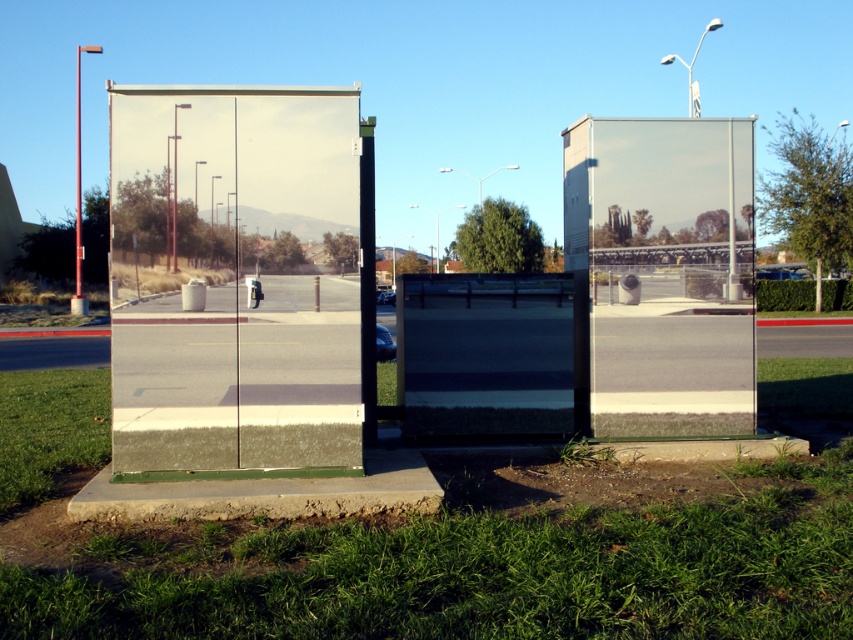
Question: Does green grass at lower center have a larger size compared to transparent glass phone box at center?

Choices:
 (A) yes
 (B) no

Answer: (A)

Question: Is metallic reflective bus stop at left in front of transparent glass phone box at center?

Choices:
 (A) no
 (B) yes

Answer: (B)

Question: Which object appears farthest from the camera in this image?

Choices:
 (A) transparent glass phone box at center
 (B) metallic reflective bus stop at left
 (C) green grass at lower center

Answer: (A)

Question: Which point is closer to the camera?

Choices:
 (A) green grass at lower center
 (B) metallic reflective bus stop at left
 (C) transparent glass phone box at center

Answer: (A)

Question: Which point is closer to the camera taking this photo?

Choices:
 (A) (4, 470)
 (B) (242, 292)

Answer: (B)

Question: Can you confirm if green grass at lower center is positioned below transparent glass phone box at center?

Choices:
 (A) no
 (B) yes

Answer: (B)